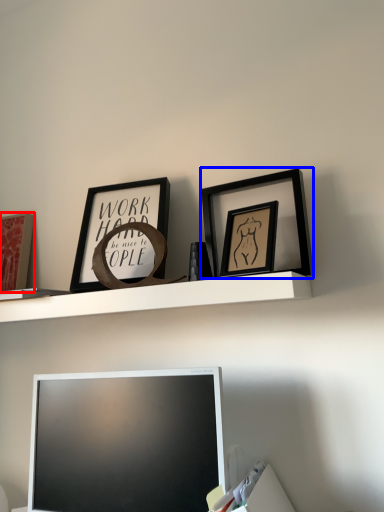
Question: Which object appears farthest to the camera in this image, picture frame (highlighted by a red box) or picture frame (highlighted by a blue box)?

Choices:
 (A) picture frame
 (B) picture frame

Answer: (A)